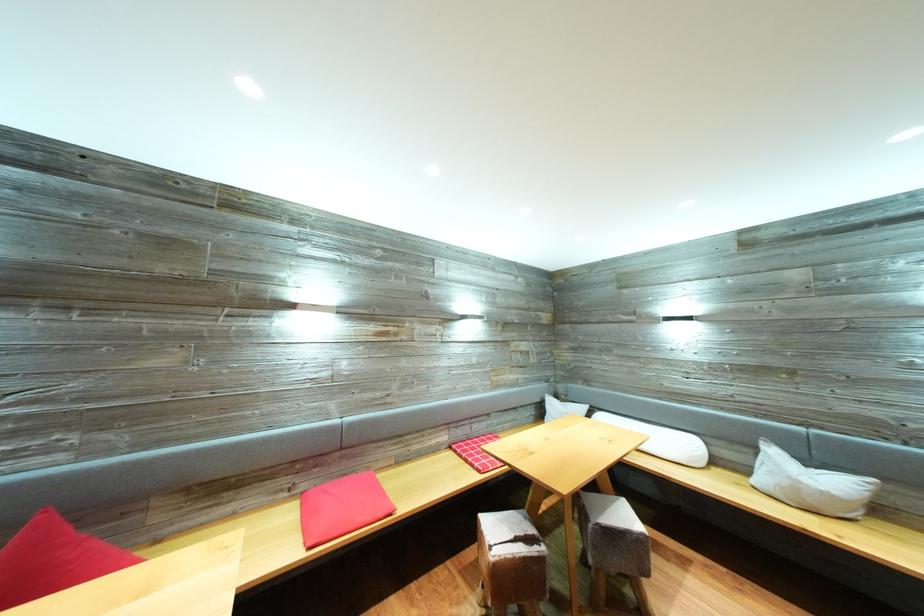
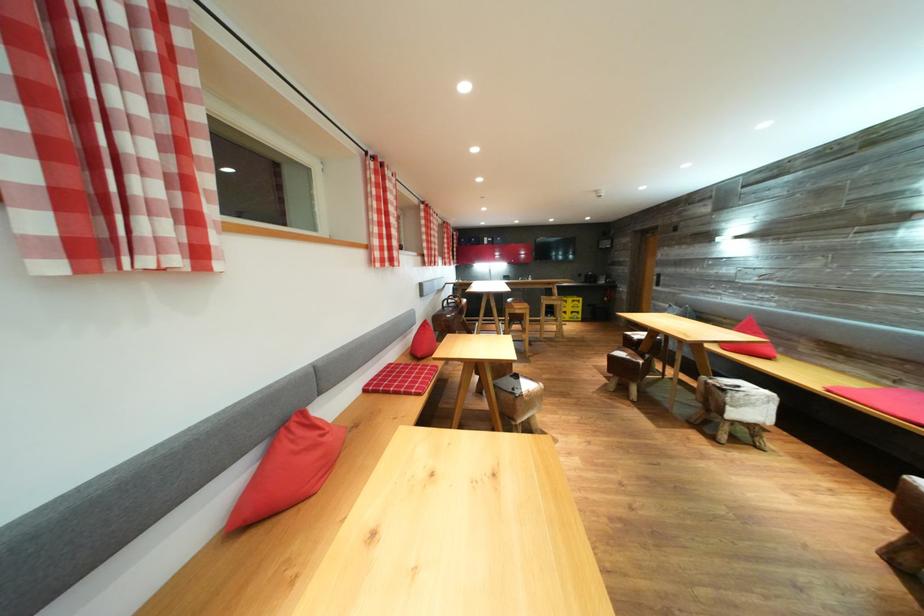
Locate, in the second image, the point that corresponds to (292,500) in the first image.

(895, 389)